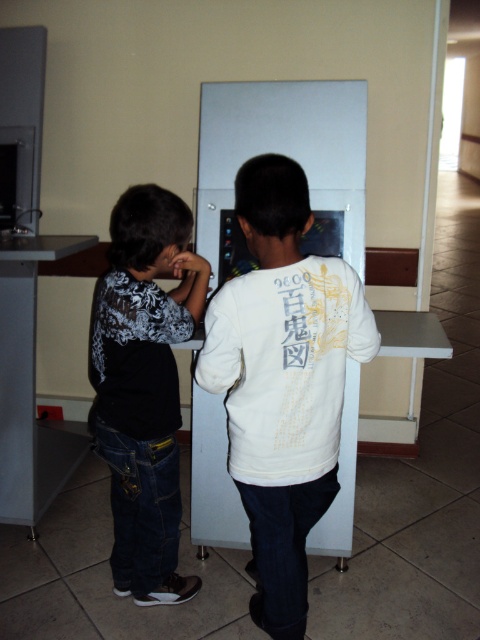
You are a photographer positioned in front of the two children. You want to take a photo of the black matte shirt at left without the white matte sweatshirt at center blocking it. Is this possible?

The white matte sweatshirt at center is in front of the black matte shirt at left, so it is blocking the view. Therefore, it is not possible to take a photo of the black matte shirt at left without the white matte sweatshirt at center blocking it.